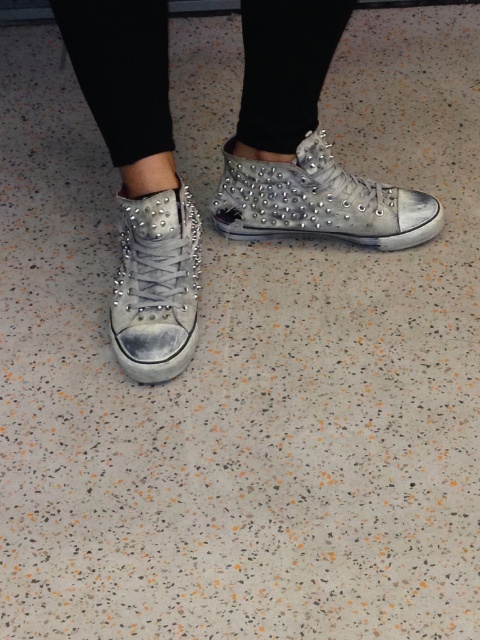
You are a shoe designer who wants to create a new sneaker collection. You have two sneakers in front of you, the distressed white sneakers at center and the silver studded sneaker at center. Which one should you choose if you want to feature a larger shoe in your design?

The distressed white sneakers at center is bigger than the silver studded sneaker at center, so you should choose the distressed white sneakers at center for a larger shoe design.

You are a shoe designer trying to create a new sneaker collection. You have two sneakers in front of you, the silver studded sneaker at center and the distressed white leather sneaker at center. Which sneaker should you choose if you want to feature a larger shoe in your collection?

The silver studded sneaker at center is larger in size than the distressed white leather sneaker at center, so you should choose the silver studded sneaker at center for the larger shoe in your collection.

You are trying to decide which sneaker to wear today. You have a silver studded sneaker at center and a distressed white leather sneaker at center. Based on their appearance, which one might be more comfortable for a day of walking?

The distressed white leather sneaker at center might be more comfortable for walking since it is likely less wide than the silver studded sneaker at center, which could cause discomfort over long periods.